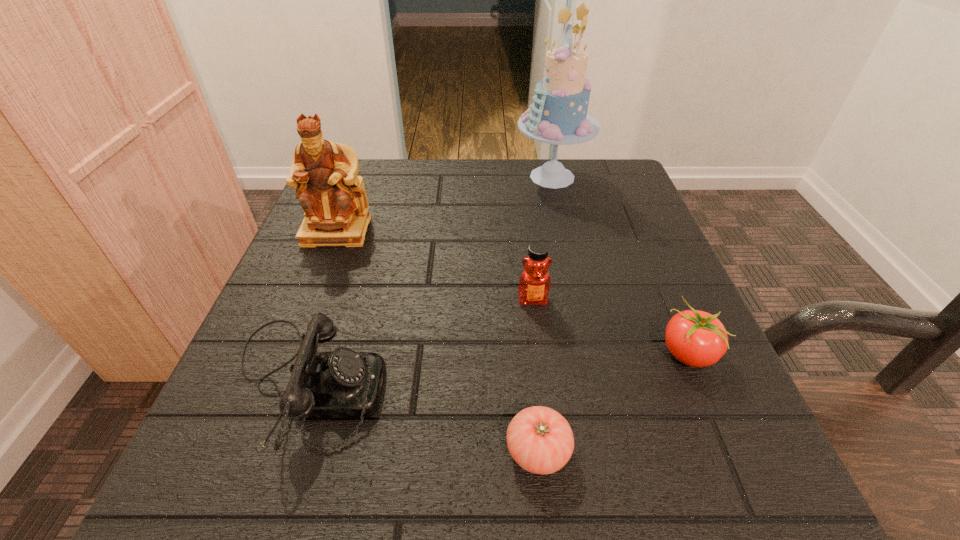
In order to click on the farthest object in this screenshot , I will do `click(558, 115)`.

In order to click on the tallest object in this screenshot , I will do `click(558, 115)`.

I want to click on figurine, so click(x=324, y=173).

Where is `the fifth nearest object`? This screenshot has width=960, height=540. the fifth nearest object is located at coordinates (324, 173).

Identify the location of honey. (534, 284).

You are a GUI agent. You are given a task and a screenshot of the screen. Output one action in this format:
    pyautogui.click(x=<x>, y=<y>)
    Task: Click on the fourth shortest object
    
    Given the screenshot: What is the action you would take?
    tap(534, 284)

Identify the location of telephone. pyautogui.click(x=343, y=383).

I want to click on the rightmost object, so click(x=696, y=338).

Where is `the right tomato`? The height and width of the screenshot is (540, 960). the right tomato is located at coordinates (696, 338).

Find the location of a particular element. This screenshot has width=960, height=540. the shortest object is located at coordinates (540, 440).